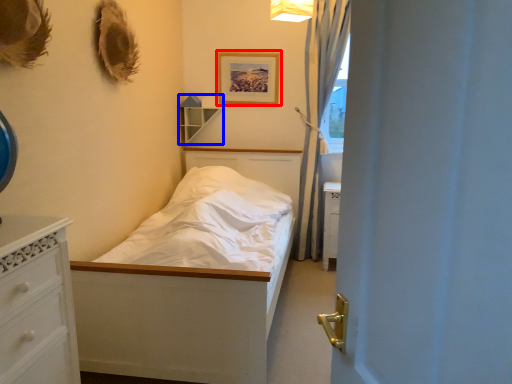
Question: Which point is closer to the camera, picture frame (highlighted by a red box) or shelf (highlighted by a blue box)?

Choices:
 (A) picture frame
 (B) shelf

Answer: (A)